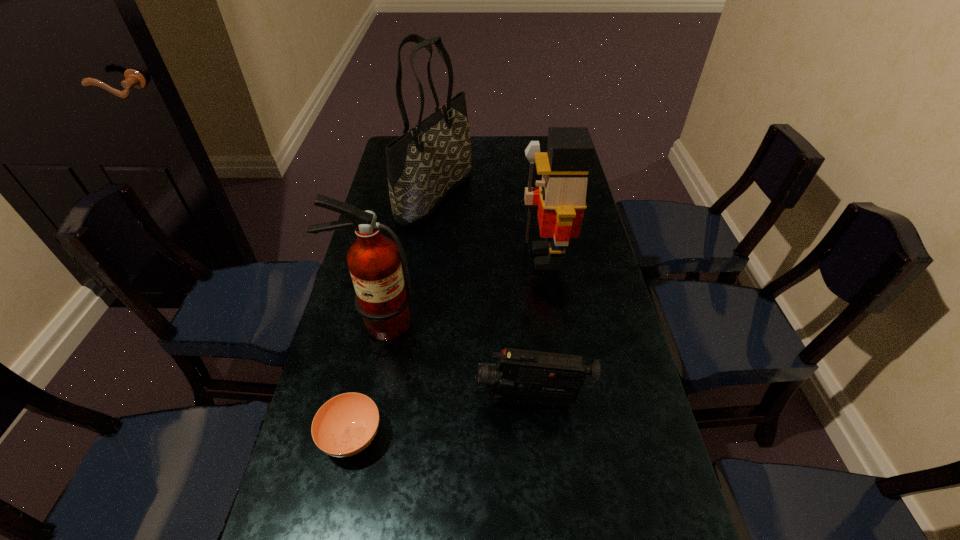
The image size is (960, 540). Identify the location of the tallest object. click(x=425, y=164).

This screenshot has height=540, width=960. Find the location of `tote bag`. tote bag is located at coordinates (425, 164).

Find the location of a particular element. The height and width of the screenshot is (540, 960). nutcracker is located at coordinates (561, 196).

Where is `fire extinguisher`? fire extinguisher is located at coordinates (382, 299).

What are the coordinates of `the second shortest object` in the screenshot? It's located at (523, 377).

Identify the location of soup bowl. (345, 425).

In order to click on vacant region located on the left of the tallest object in this screenshot , I will do `click(377, 195)`.

Locate an element on the screen. The width and height of the screenshot is (960, 540). vacant space located 0.130m in front of the fourth nearest object holding the staff is located at coordinates (477, 258).

Locate an element on the screen. This screenshot has width=960, height=540. blank space located in front of the fourth nearest object holding the staff is located at coordinates (493, 258).

What are the coordinates of `vacant space located in front of the fourth nearest object holding the staff` in the screenshot? It's located at (420, 258).